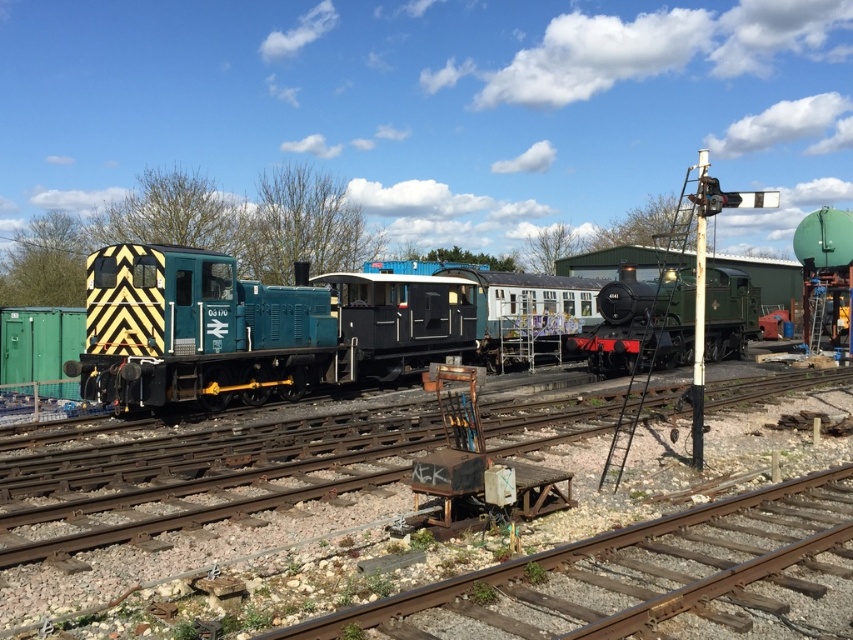
You are a railway engineer who needs to determine which locomotive has a wider body between the teal matte locomotive at left and the green polished wood steam locomotive at center. Which one is wider?

The green polished wood steam locomotive at center is wider than the teal matte locomotive at left.

You are a railway worker inspecting the tracks. You notice the teal painted metal locomotive at center and the teal matte locomotive at left. Which locomotive is positioned closer to your current viewpoint?

The teal painted metal locomotive at center is closer to the viewer than the teal matte locomotive at left, so the teal painted metal locomotive at center is positioned closer to your current viewpoint.